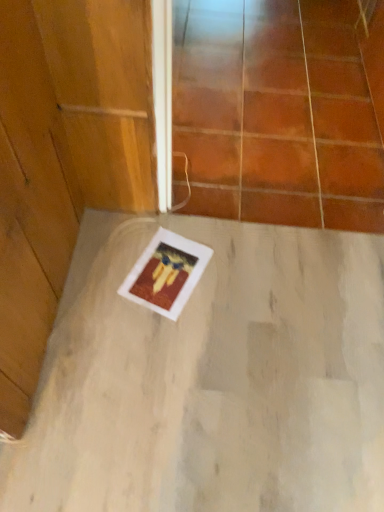
I want to click on vacant space situated above white matte concrete at center (from a real-world perspective), so click(x=226, y=355).